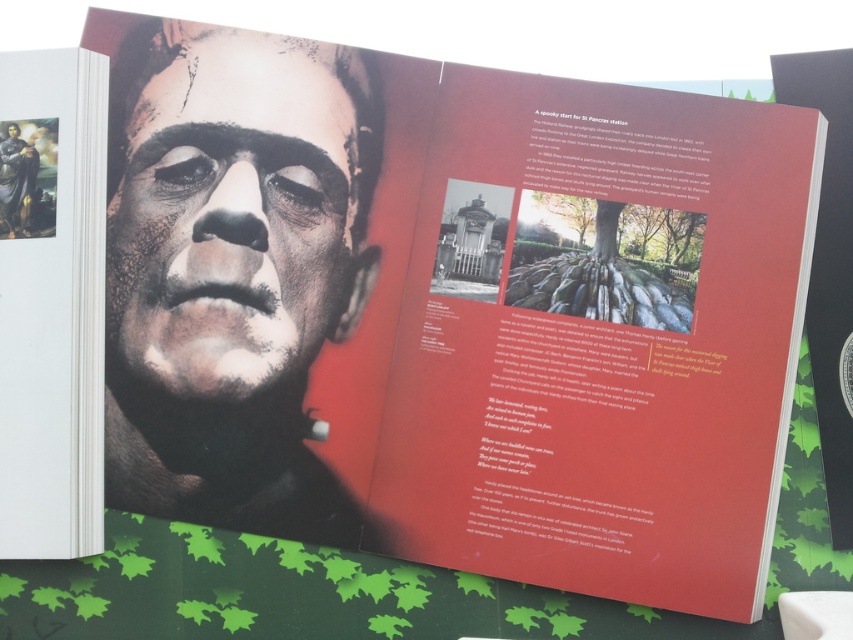
Question: Is smooth matte face at center positioned behind smooth black statue at upper left?

Choices:
 (A) yes
 (B) no

Answer: (B)

Question: Which point is closer to the camera?

Choices:
 (A) smooth matte face at center
 (B) smooth black statue at upper left

Answer: (A)

Question: Which object appears closest to the camera in this image?

Choices:
 (A) smooth black statue at upper left
 (B) smooth matte face at center

Answer: (B)

Question: Is smooth matte face at center smaller than smooth black statue at upper left?

Choices:
 (A) no
 (B) yes

Answer: (A)

Question: Which point appears closest to the camera in this image?

Choices:
 (A) pyautogui.click(x=273, y=49)
 (B) pyautogui.click(x=35, y=180)

Answer: (B)

Question: Does smooth matte face at center appear over smooth black statue at upper left?

Choices:
 (A) no
 (B) yes

Answer: (A)